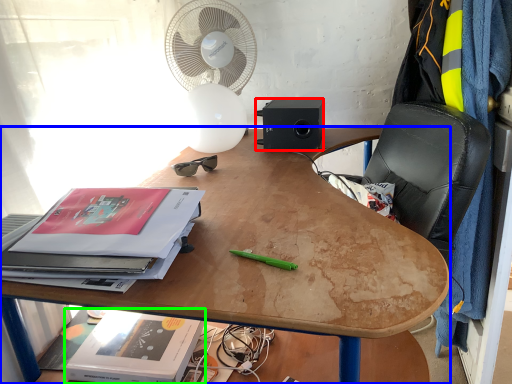
Question: Which object is the closest to the loudspeaker (highlighted by a red box)? Choose among these: desk (highlighted by a blue box) or paperback book (highlighted by a green box).

Choices:
 (A) desk
 (B) paperback book

Answer: (A)